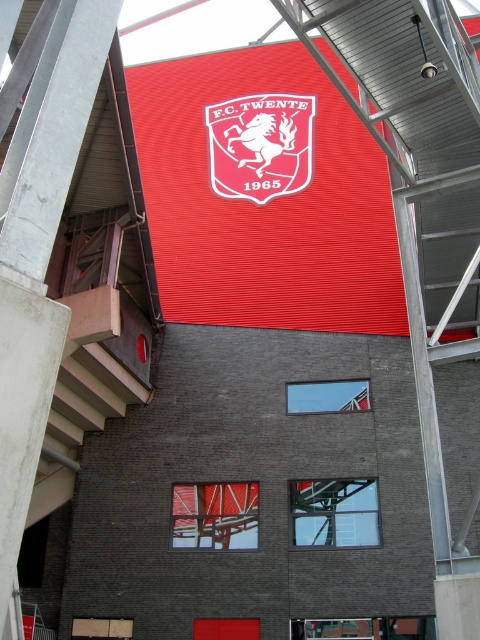
You are an event organizer planning to hang a new banner between the matte red shield at center and the red matte flag at center. Given that the banner requires 1.2 meters of space, can the available space between them accommodate it?

The matte red shield at center is bigger than the red matte flag at center, but the description does not provide specific measurements of the distance between them. Therefore, it is unclear if the 1.2 meters of space required for the banner is available.

Consider the image. You are an architect designing a new sports stadium and want to place a logo on a wall. The wall has a coordinate system where the bottom left corner is the origin. The logo must be placed at coordinates between 0.2 and 0.3 on the x and y axes. Is the matte red shield at center positioned correctly according to the coordinates provided?

The matte red shield at center is located at coordinates x 0.228 and y 0.544. Since the required x coordinate range is between 0.2 and 0.3, the x coordinate is within the specified range. However, the y coordinate of 0.544 exceeds the maximum allowed y coordinate of 0.3. Therefore, the matte red shield at center is not positioned correctly as it falls outside the required y coordinate range.